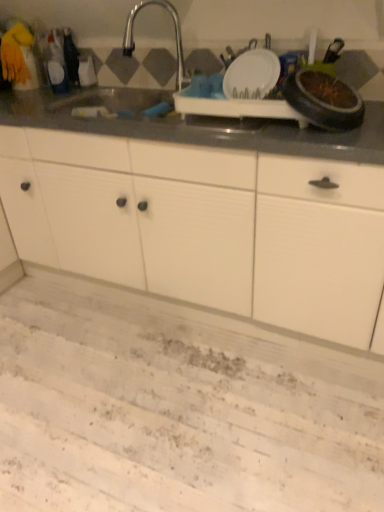
Question: From a real-world perspective, is satin nickel faucet at upper center located beneath white matte cabinet at center?

Choices:
 (A) no
 (B) yes

Answer: (A)

Question: From a real-world perspective, is satin nickel faucet at upper center on white matte cabinet at center?

Choices:
 (A) no
 (B) yes

Answer: (B)

Question: Does satin nickel faucet at upper center appear on the left side of white matte cabinet at center?

Choices:
 (A) yes
 (B) no

Answer: (A)

Question: Can you confirm if satin nickel faucet at upper center is wider than white matte cabinet at center?

Choices:
 (A) yes
 (B) no

Answer: (B)

Question: Is there a large distance between satin nickel faucet at upper center and white matte cabinet at center?

Choices:
 (A) yes
 (B) no

Answer: (B)

Question: Can you confirm if satin nickel faucet at upper center is shorter than white matte cabinet at center?

Choices:
 (A) no
 (B) yes

Answer: (B)

Question: From the image's perspective, does white matte cabinet at center appear higher than satin nickel faucet at upper center?

Choices:
 (A) yes
 (B) no

Answer: (B)

Question: From a real-world perspective, is white matte cabinet at center physically above satin nickel faucet at upper center?

Choices:
 (A) yes
 (B) no

Answer: (B)

Question: From the image's perspective, is white matte cabinet at center under satin nickel faucet at upper center?

Choices:
 (A) yes
 (B) no

Answer: (A)

Question: Considering the relative sizes of white matte cabinet at center and satin nickel faucet at upper center in the image provided, is white matte cabinet at center smaller than satin nickel faucet at upper center?

Choices:
 (A) no
 (B) yes

Answer: (A)

Question: Considering the relative sizes of white matte cabinet at center and satin nickel faucet at upper center in the image provided, is white matte cabinet at center taller than satin nickel faucet at upper center?

Choices:
 (A) no
 (B) yes

Answer: (B)

Question: Is the position of white matte cabinet at center less distant than that of satin nickel faucet at upper center?

Choices:
 (A) no
 (B) yes

Answer: (B)

Question: In terms of width, does satin nickel faucet at upper center look wider or thinner when compared to white matte cabinet at center?

Choices:
 (A) wide
 (B) thin

Answer: (B)